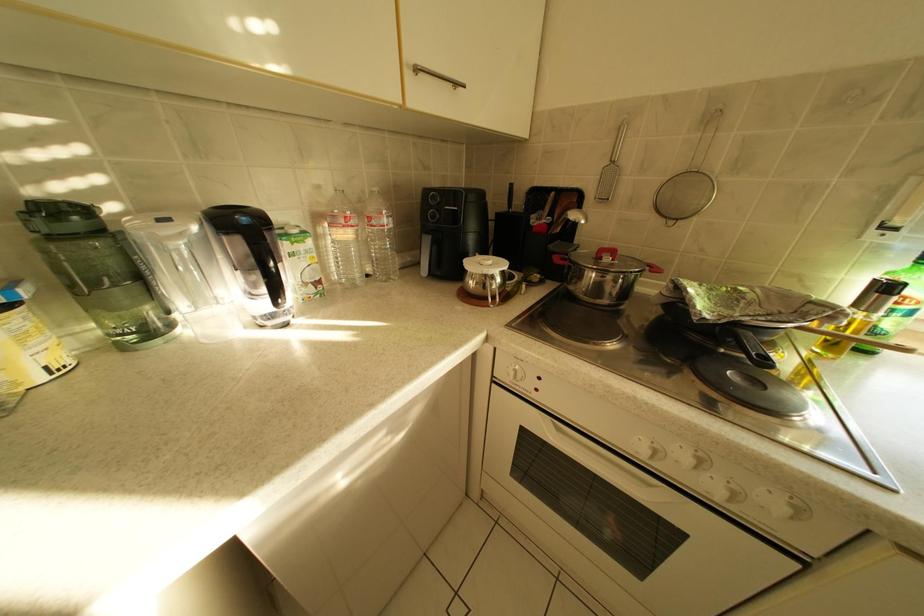
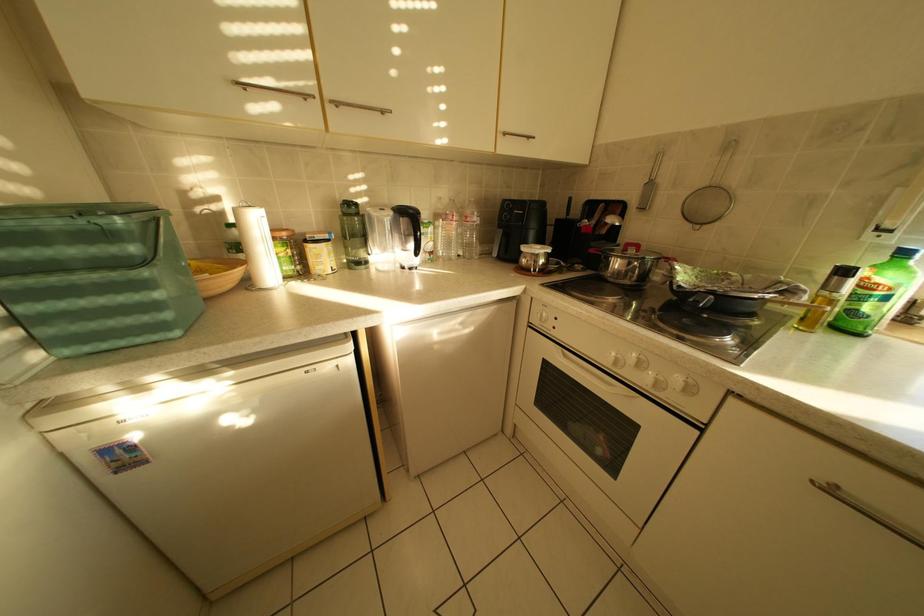
Question: Based on the continuous images, in which direction is the camera rotating? Reply with the corresponding letter.

Choices:
 (A) Left
 (B) Right
 (C) Up
 (D) Down

Answer: (A)